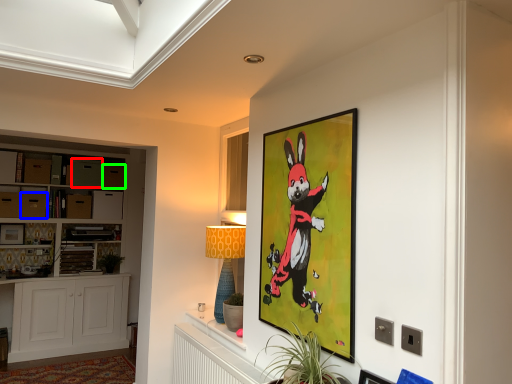
Question: Which is farther away from drawer (highlighted by a red box)? drawer (highlighted by a blue box) or drawer (highlighted by a green box)?

Choices:
 (A) drawer
 (B) drawer

Answer: (A)